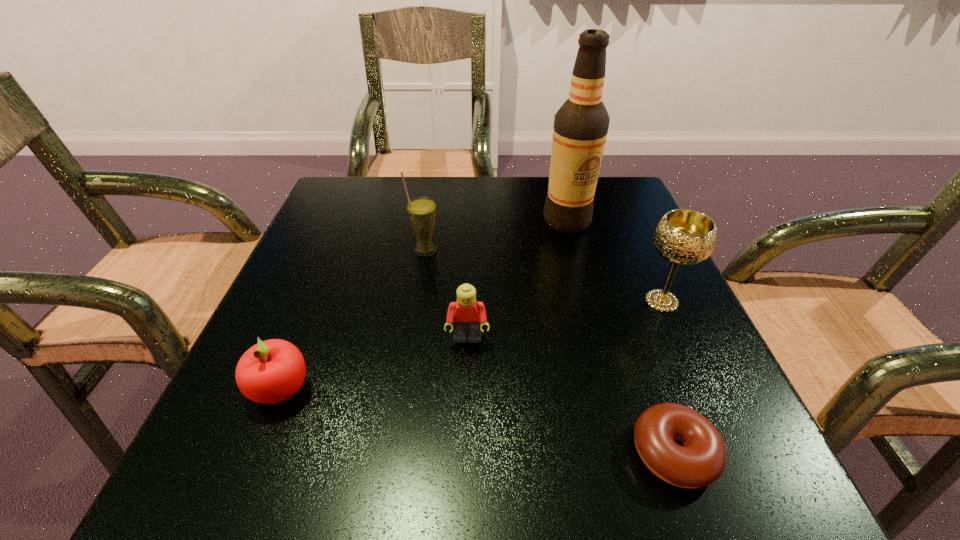
Locate an element on the screen. The width and height of the screenshot is (960, 540). the farthest object is located at coordinates (580, 129).

Identify the location of the tallest object. point(580,129).

Locate an element on the screen. the fifth nearest object is located at coordinates (422, 211).

I want to click on straw for drinking, so click(422, 211).

Identify the location of the third farthest object. Image resolution: width=960 pixels, height=540 pixels. (683, 237).

Identify the location of the fourth object from right to left. Image resolution: width=960 pixels, height=540 pixels. (467, 314).

The image size is (960, 540). I want to click on Lego, so click(467, 314).

Locate an element on the screen. Image resolution: width=960 pixels, height=540 pixels. the leftmost object is located at coordinates (271, 371).

Identify the location of doughnut. (701, 461).

I want to click on free space located on the label of the tallest object, so click(x=575, y=248).